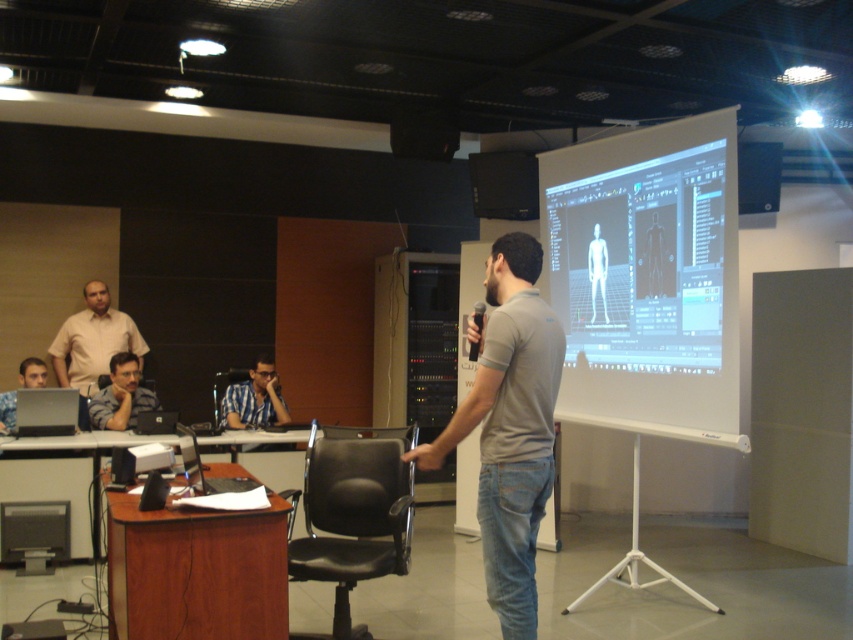
You are an attendee sitting in the front row of the seminar. You see the blue checkered shirt at center and the translucent white human figure at center. Which object is closer to you?

The blue checkered shirt at center is closer to you because it is further to the viewer than the translucent white human figure at center.

You are an attendee at the seminar and want to take a photo of both the blue checkered shirt at center and the translucent white human figure at center. Which object should you focus on first if you want to ensure both are in frame without moving the camera?

The blue checkered shirt at center is wider than the translucent white human figure at center, so focus on the blue checkered shirt at center first to ensure both fit in the frame.